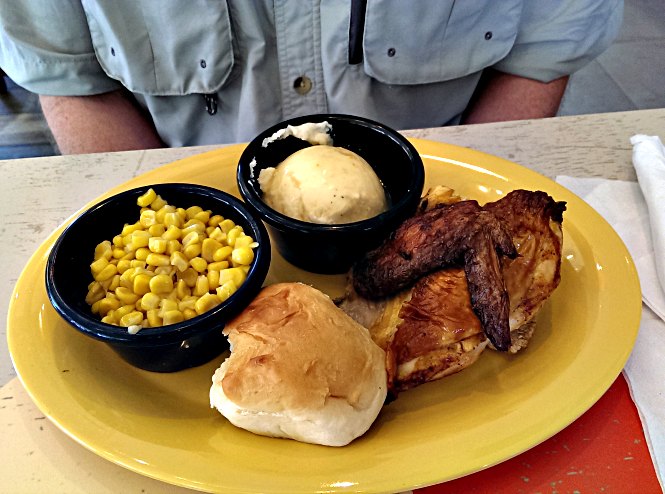
Identify the location of napkins. This screenshot has height=494, width=665. pos(654,240).